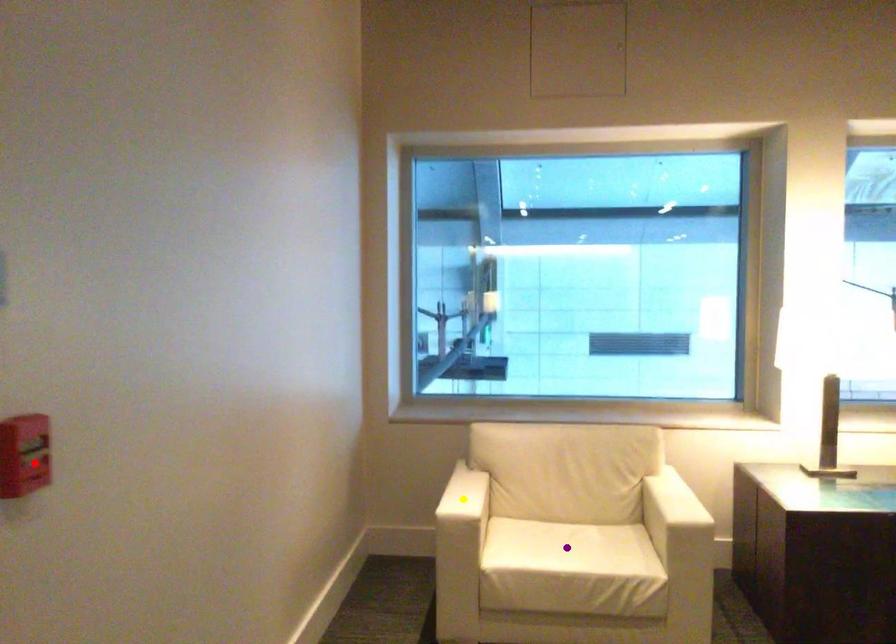
Order these from nearest to farthest:
yellow point | purple point | red point

red point, purple point, yellow point